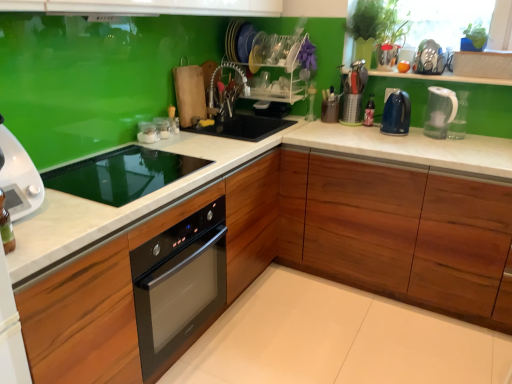
Where is `free location in front of clear glass jar at upper center, acting as the sixth appliance starting from the right`? The width and height of the screenshot is (512, 384). free location in front of clear glass jar at upper center, acting as the sixth appliance starting from the right is located at coordinates (139, 147).